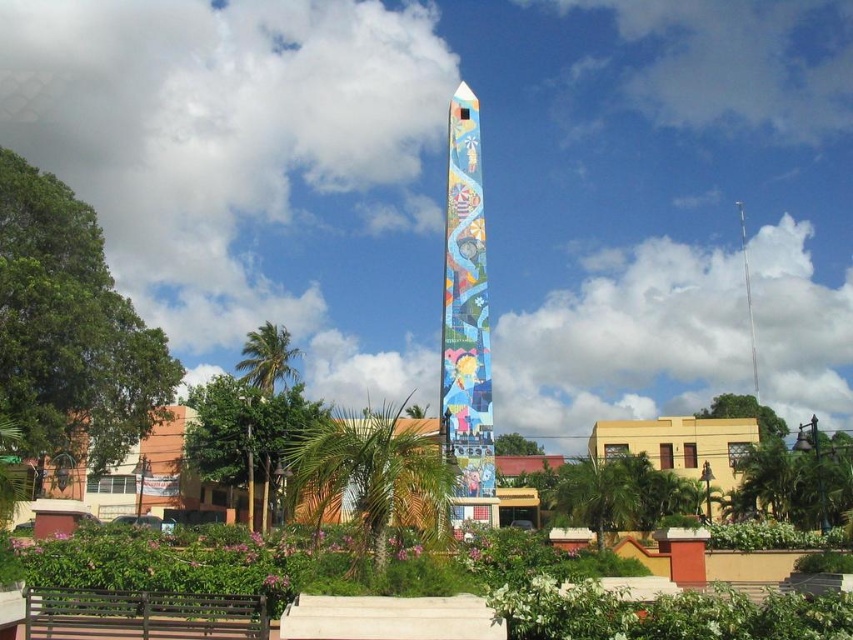
Question: Which point appears farthest from the camera in this image?

Choices:
 (A) (258, 634)
 (B) (447, 304)

Answer: (B)

Question: Can you confirm if multicolored mosaic obelisk at center is positioned above brown wooden bench at lower left?

Choices:
 (A) no
 (B) yes

Answer: (B)

Question: Is multicolored mosaic obelisk at center further to camera compared to brown wooden bench at lower left?

Choices:
 (A) yes
 (B) no

Answer: (A)

Question: Which point is closer to the camera?

Choices:
 (A) multicolored mosaic obelisk at center
 (B) brown wooden bench at lower left

Answer: (B)

Question: Does multicolored mosaic obelisk at center appear under brown wooden bench at lower left?

Choices:
 (A) no
 (B) yes

Answer: (A)